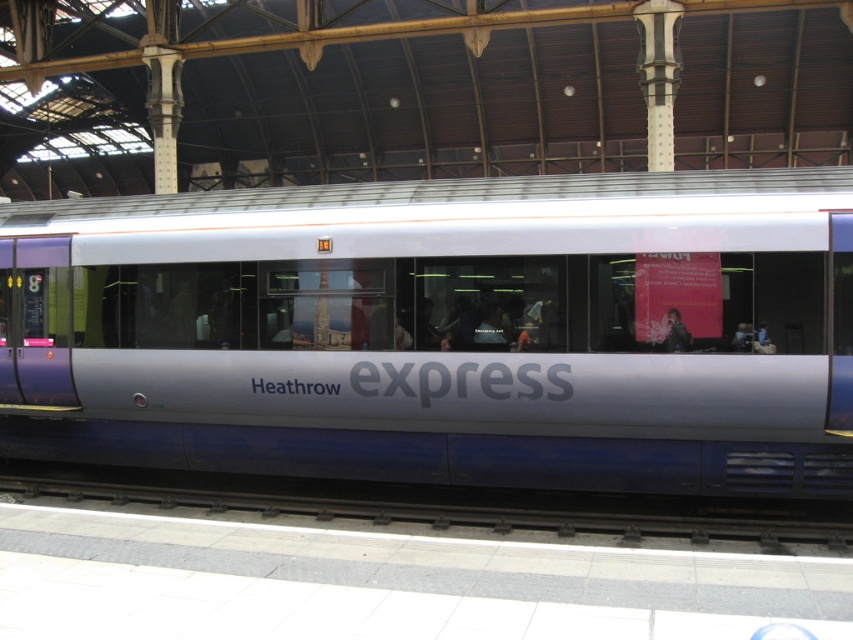
Based on the photo, is silver metallic train at center below black metal train track at lower center?

No.

Does silver metallic train at center come in front of black metal train track at lower center?

Yes, it is in front of black metal train track at lower center.

The height and width of the screenshot is (640, 853). I want to click on silver metallic train at center, so click(444, 332).